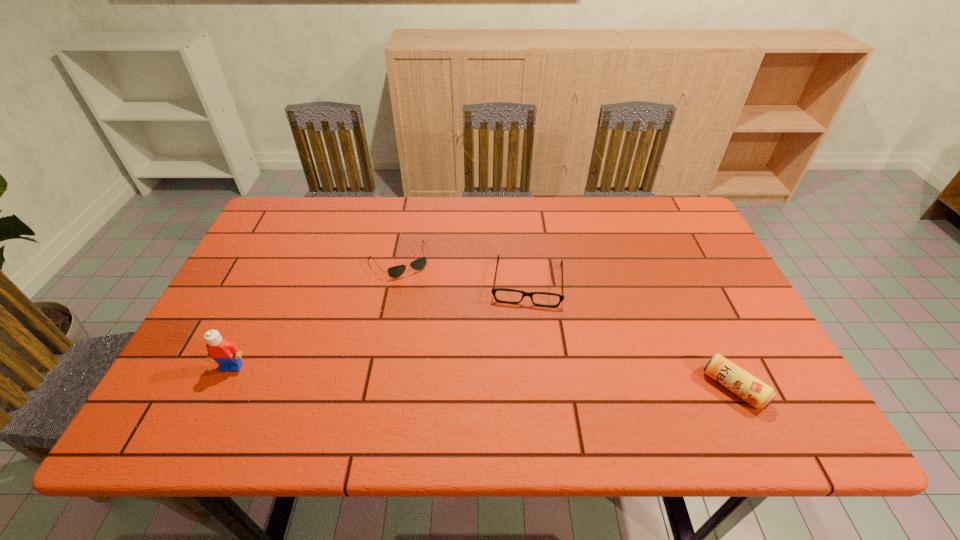
The width and height of the screenshot is (960, 540). In order to click on vacant space on the desktop that is between the tallest object and the beer can and is positioned on the lenses of the second object from left to right in this screenshot , I will do `click(466, 376)`.

Identify the location of free space on the desktop that is between the Lego and the beer can and is positioned on the front-facing side of the spectacles. The height and width of the screenshot is (540, 960). (521, 379).